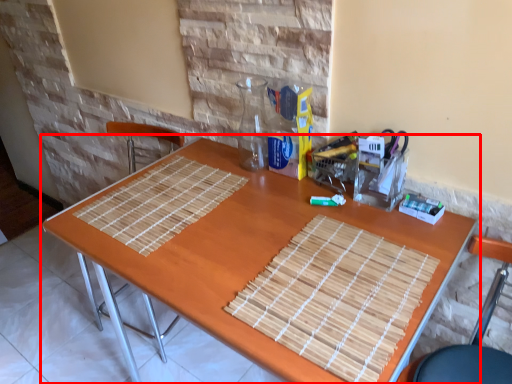
Question: From the image's perspective, what is the correct spatial positioning of table (annotated by the red box) in reference to chair?

Choices:
 (A) above
 (B) below

Answer: (A)